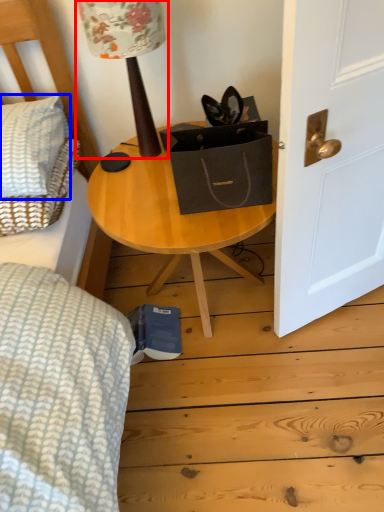
Question: Among these objects, which one is nearest to the camera, table lamp (highlighted by a red box) or pillow (highlighted by a blue box)?

Choices:
 (A) table lamp
 (B) pillow

Answer: (A)